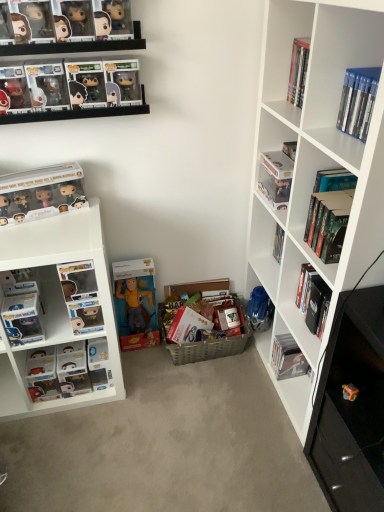
Question: From their relative heights in the image, would you say white matte bookshelf at right is taller or shorter than hardcover book at lower right, the 5th book when ordered from left to right?

Choices:
 (A) short
 (B) tall

Answer: (B)

Question: Is point (350, 143) positioned closer to the camera than point (271, 367)?

Choices:
 (A) farther
 (B) closer

Answer: (B)

Question: Estimate the real-world distances between objects in this image. Which object is closer to the translucent plastic cube at lower right, which is the first toy in bottom-to-top order?

Choices:
 (A) woven brown basket at center
 (B) white matte bookshelf at right
 (C) hardcover book at upper right, the first book when ordered from right to left
 (D) matte black pop vinyl figures at upper left, which is the first book in left-to-right order
 (E) matte plastic pop vinyl figure at lower left, placed as the 7th book when sorted from right to left

Answer: (C)

Question: Which is nearer to the hardcover book at upper right, which ranks as the 8th book in left-to-right order?

Choices:
 (A) white matte bookshelf at right
 (B) hardcover book at upper right, acting as the fourth book starting from the left
 (C) matte black figurine at upper left, which appears as the 2th toy when ordered from the bottom
 (D) black matte book at lower right, which appears as the seventh book when viewed from the left
 (E) hardcover book at lower right, the fourth book positioned from the right

Answer: (A)